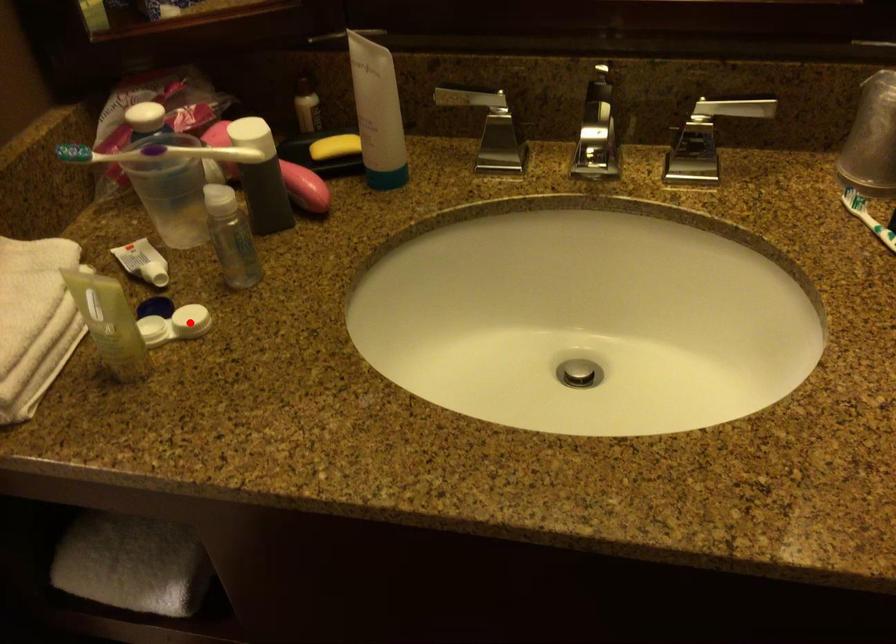
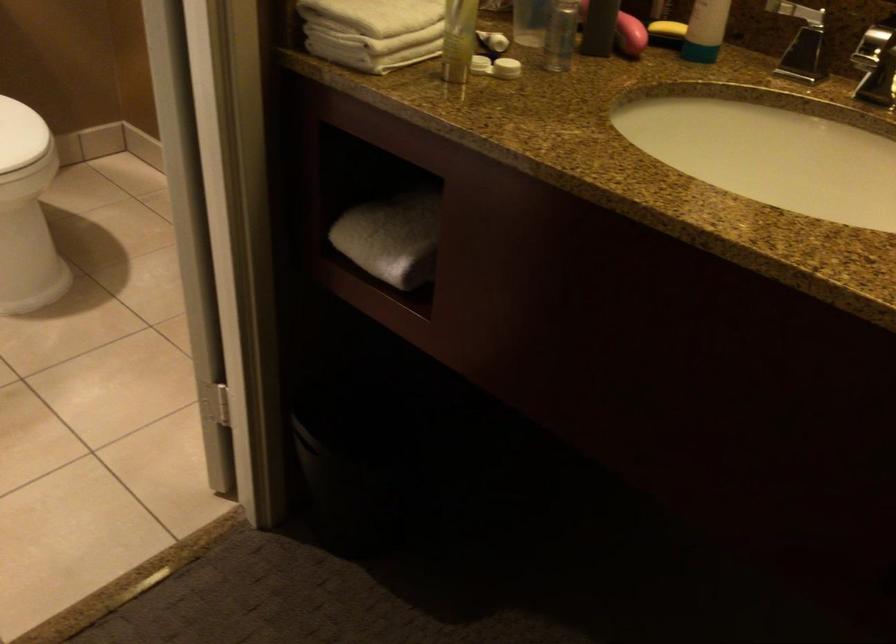
Question: A red point is marked in image1. In image2, is the corresponding 3D point closer to the camera or farther? Reply with the corresponding letter.

Choices:
 (A) The corresponding 3D point is closer.
 (B) The corresponding 3D point is farther.

Answer: (B)